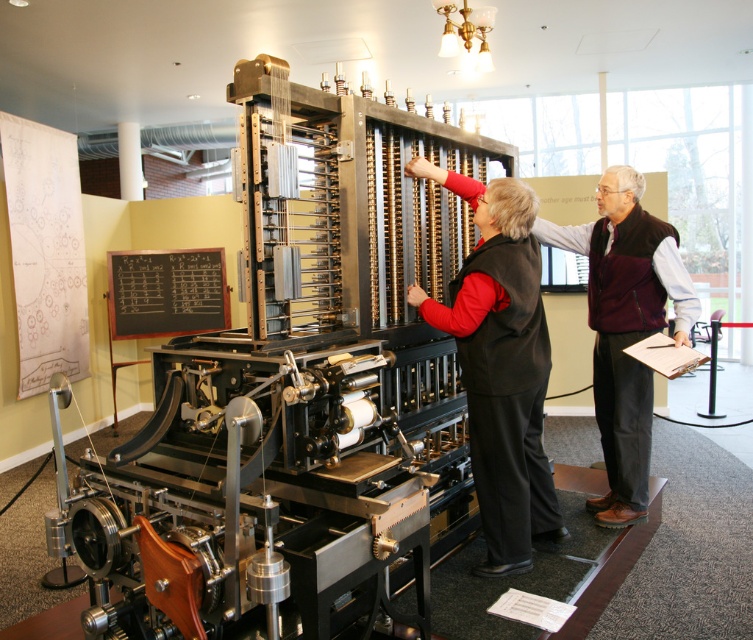
You are a tour guide at the museum and want to point out both the black vest at center and the black chalkboard at center to your visitors. Which object should you mention first if you want to follow the order from top to bottom?

You should mention the black chalkboard at center first because it is located above the black vest at center.

You are a tour guide at the museum and want to ensure visitors can see both the black vest at center and the black chalkboard at center clearly. Based on their sizes, which one should you recommend standing closer to for a better view?

The black vest at center is bigger than the black chalkboard at center, so visitors should stand closer to the black chalkboard at center to see both objects clearly.

You are a tour guide explaining the historical mechanical device to visitors. You need to point out the black vest at center to emphasize its significance. Where exactly should you direct your visitors to look?

The black vest at center is located at point 0.480 on the x axis and 0.799 on the y axis.